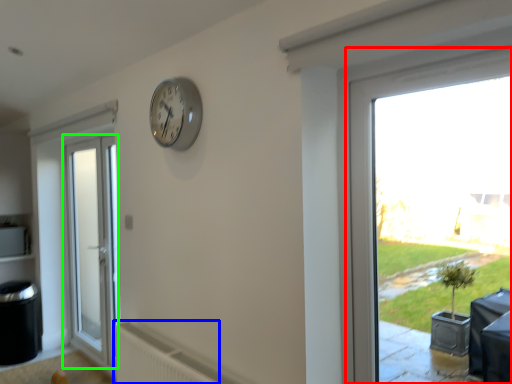
Question: Considering the real-world distances, which object is closest to window (highlighted by a red box)? radiator (highlighted by a blue box) or door (highlighted by a green box).

Choices:
 (A) radiator
 (B) door

Answer: (A)